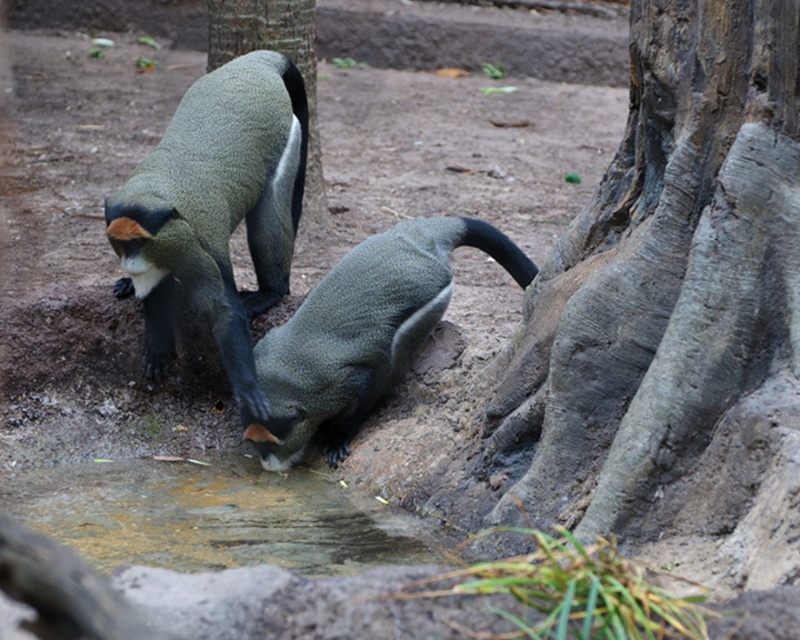
Two monkeys are at the coordinates point (366,337). If you want to place a feeding station exactly halfway between them, what coordinates should you use?

The coordinates for the feeding station should be the midpoint between the two monkeys. Since they are 4.83 meters apart, the halfway point would be at 2.415 meters from each monkey. However, without specific coordinate values, we can only state the distance, not the exact coordinates.

Consider the image. You are a zookeeper trying to ensure the monkeys have enough space to drink. The brown dirt puddle at lower center and the green textured monkey at upper center are in the enclosure. Based on their sizes, can the monkey fit comfortably next to the puddle to drink?

The brown dirt puddle at lower center is wider than the green textured monkey at upper center, so there should be enough space for the monkey to drink comfortably next to the puddle.

You are a zookeeper observing the monkeys in their enclosure. You notice the green textured monkey at upper center and the brown dirt puddle at lower center. Which object is located to the left of the other?

The brown dirt puddle at lower center is positioned on the left side of green textured monkey at upper center.